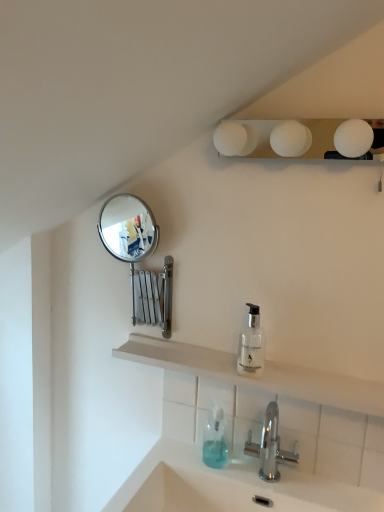
Question: Is the surface of white matte light fixture at upper center in direct contact with white matte shelf at center?

Choices:
 (A) yes
 (B) no

Answer: (B)

Question: Is white matte light fixture at upper center wider than white matte shelf at center?

Choices:
 (A) no
 (B) yes

Answer: (B)

Question: Considering the relative sizes of white matte light fixture at upper center and white matte shelf at center in the image provided, is white matte light fixture at upper center taller than white matte shelf at center?

Choices:
 (A) yes
 (B) no

Answer: (A)

Question: From a real-world perspective, is white matte light fixture at upper center located beneath white matte shelf at center?

Choices:
 (A) no
 (B) yes

Answer: (A)

Question: Is white matte light fixture at upper center located outside white matte shelf at center?

Choices:
 (A) no
 (B) yes

Answer: (B)

Question: Is silver metallic mirror at upper left situated inside chrome metallic faucet at lower center or outside?

Choices:
 (A) outside
 (B) inside

Answer: (A)

Question: In the image, is silver metallic mirror at upper left on the left side or the right side of chrome metallic faucet at lower center?

Choices:
 (A) left
 (B) right

Answer: (A)

Question: From the image's perspective, is silver metallic mirror at upper left located above or below chrome metallic faucet at lower center?

Choices:
 (A) below
 (B) above

Answer: (B)

Question: Is point (153, 242) closer or farther from the camera than point (278, 472)?

Choices:
 (A) closer
 (B) farther

Answer: (B)

Question: Considering their positions, is silver metallic mirror at upper left located in front of or behind white matte shelf at center?

Choices:
 (A) behind
 (B) front

Answer: (A)

Question: Based on their positions, is silver metallic mirror at upper left located to the left or right of white matte shelf at center?

Choices:
 (A) left
 (B) right

Answer: (A)

Question: Considering the positions of silver metallic mirror at upper left and white matte shelf at center in the image, is silver metallic mirror at upper left wider or thinner than white matte shelf at center?

Choices:
 (A) wide
 (B) thin

Answer: (B)

Question: Choose the correct answer: Is silver metallic mirror at upper left inside white matte shelf at center or outside it?

Choices:
 (A) inside
 (B) outside

Answer: (B)

Question: Considering the positions of silver metallic mirror at upper left and translucent plastic soap dispenser at lower center, which is the 2th soap dispenser in right-to-left order, in the image, is silver metallic mirror at upper left bigger or smaller than translucent plastic soap dispenser at lower center, which is the 2th soap dispenser in right-to-left order,?

Choices:
 (A) big
 (B) small

Answer: (A)

Question: From a real-world perspective, is silver metallic mirror at upper left physically located above or below translucent plastic soap dispenser at lower center, placed as the first soap dispenser when sorted from bottom to top?

Choices:
 (A) below
 (B) above

Answer: (B)